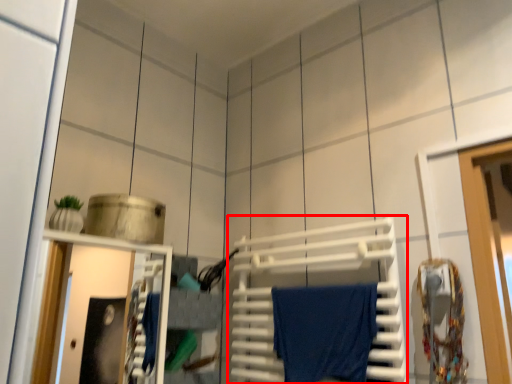
Question: Considering the relative positions of wide (annotated by the red box) and bath towel in the image provided, where is wide (annotated by the red box) located with respect to the staircase?

Choices:
 (A) left
 (B) right

Answer: (A)